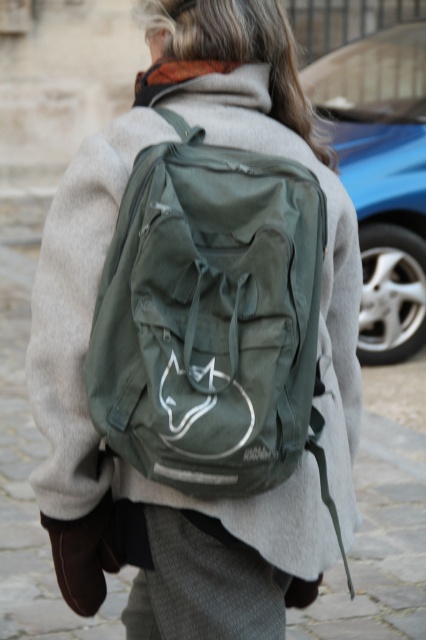
Question: Is olive green fabric backpack at center bigger than blue metallic car at upper right?

Choices:
 (A) no
 (B) yes

Answer: (A)

Question: Which of the following is the farthest from the observer?

Choices:
 (A) [394, 177]
 (B) [264, 326]

Answer: (A)

Question: Can you confirm if olive green fabric backpack at center is wider than blue metallic car at upper right?

Choices:
 (A) yes
 (B) no

Answer: (B)

Question: From the image, what is the correct spatial relationship of olive green fabric backpack at center in relation to blue metallic car at upper right?

Choices:
 (A) right
 (B) left

Answer: (B)